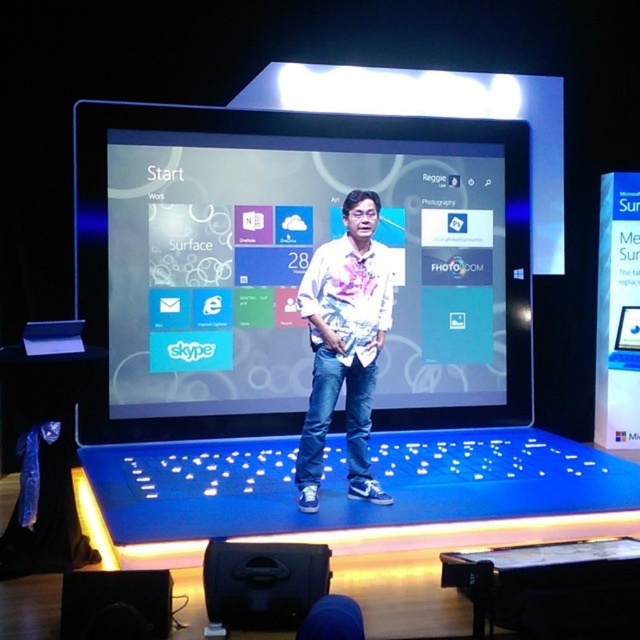
Is matte plastic screen at center thinner than white printed shirt at center?

No.

Which is more to the left, matte plastic screen at center or white printed shirt at center?

Positioned to the left is matte plastic screen at center.

What do you see at coordinates (292, 266) in the screenshot? I see `matte plastic screen at center` at bounding box center [292, 266].

Image resolution: width=640 pixels, height=640 pixels. Identify the location of matte plastic screen at center. pos(292,266).